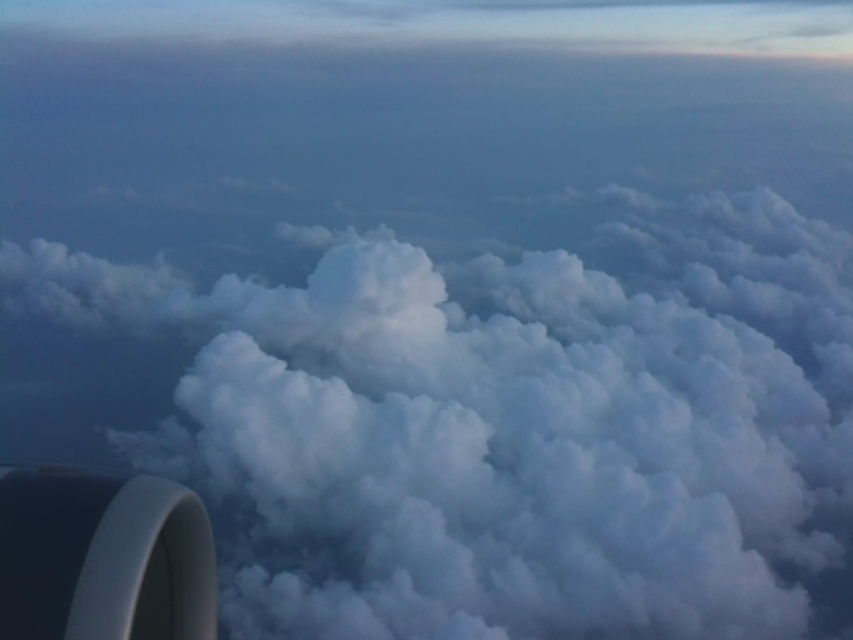
Can you confirm if white fluffy cloud at center is positioned above white matte engine at bottom left?

Incorrect, white fluffy cloud at center is not positioned above white matte engine at bottom left.

Does white fluffy cloud at center have a smaller size compared to white matte engine at bottom left?

Actually, white fluffy cloud at center might be larger than white matte engine at bottom left.

Describe the element at coordinates (509, 426) in the screenshot. I see `white fluffy cloud at center` at that location.

Find the location of `white fluffy cloud at center`. white fluffy cloud at center is located at coordinates (509, 426).